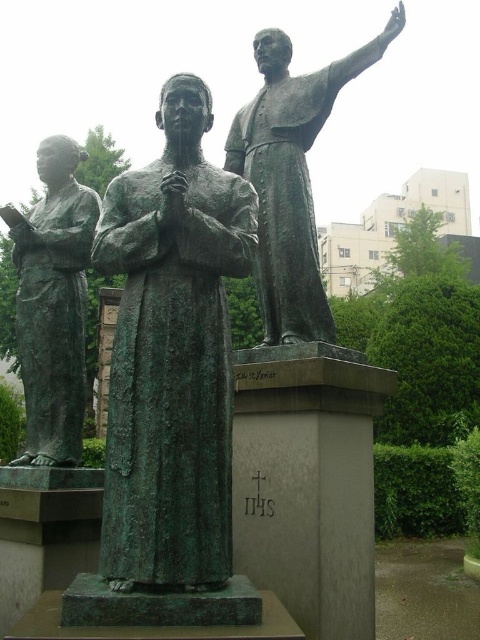
You are standing at the center of the park and want to locate the bronze statue at upper right. Which direction should you face to see it?

The bronze statue at upper right is located at point (290, 177), which is to the upper right direction from your current position at the center of the park.

In the scene shown: You are an art student analyzing the statue group. You notice the green patina bronze statue at center and the bronze statue at upper right. Which of these two statues is shorter?

The green patina bronze statue at center is shorter than the bronze statue at upper right.

You are an art student analyzing the spatial arrangement of the statues in the image. Based on the statues labeled as the green patina bronze statue at center and bronze statue at upper right, which one appears smaller in size when viewed from your perspective?

The green patina bronze statue at center occupies less space than the bronze statue at upper right, so it appears smaller in size when viewed from your perspective.